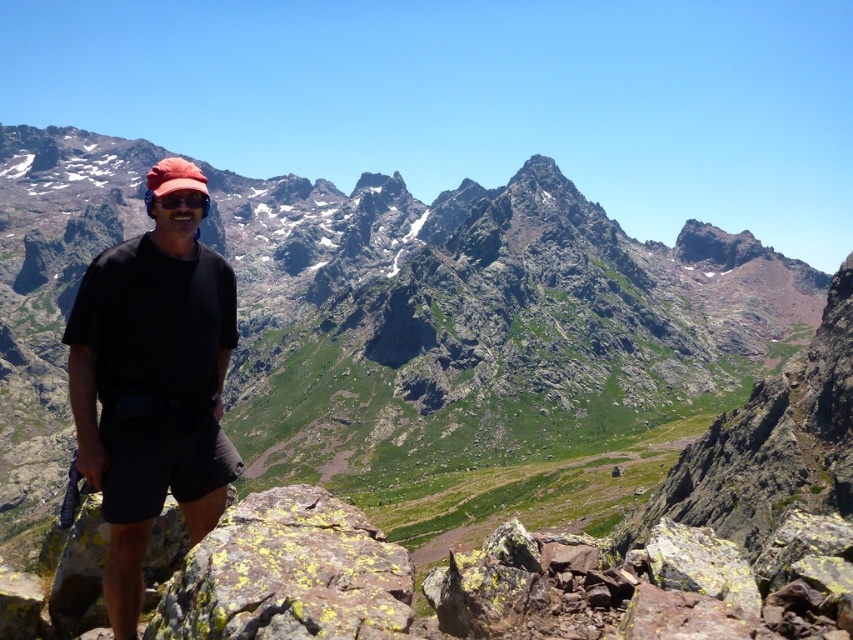
Question: Which of the following is the closest to the observer?

Choices:
 (A) yellow lichen-covered rock at lower center
 (B) black matte shirt at center
 (C) transparent plastic goggles at center

Answer: (A)

Question: Which object appears farthest from the camera in this image?

Choices:
 (A) black matte shirt at center
 (B) transparent plastic goggles at center

Answer: (B)

Question: Which point appears closest to the camera in this image?

Choices:
 (A) (132, 244)
 (B) (166, 200)
 (C) (392, 564)

Answer: (C)

Question: Does black matte shirt at center appear under transparent plastic goggles at center?

Choices:
 (A) yes
 (B) no

Answer: (A)

Question: Is yellow lichen-covered rock at lower center positioned at the back of transparent plastic goggles at center?

Choices:
 (A) yes
 (B) no

Answer: (B)

Question: Considering the relative positions of yellow lichen-covered rock at lower center and transparent plastic goggles at center in the image provided, where is yellow lichen-covered rock at lower center located with respect to transparent plastic goggles at center?

Choices:
 (A) above
 (B) below

Answer: (B)